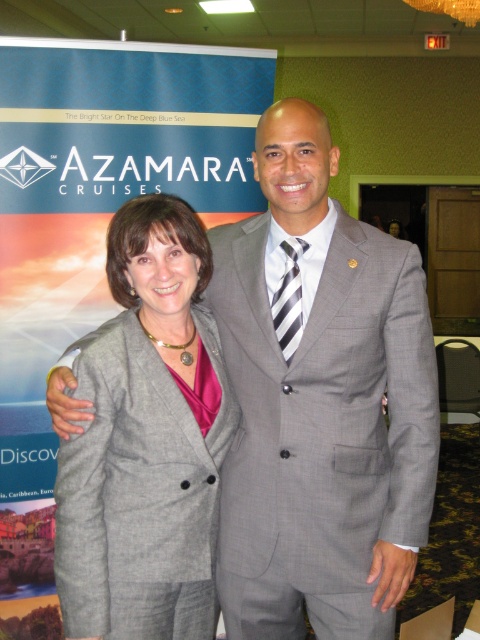
You are attending a cruise event and see two suits displayed at the center of the Azamara Cruises promotional backdrop. The gray textured suit at center and the gray wool suit at center. Which one is larger in size?

The gray textured suit at center is bigger than the gray wool suit at center.

You are attending a cruise event and see two suits displayed at the center of the Azamara Cruises promotional backdrop. The suits are labeled as gray textured suit at center and gray wool suit at center. Which one is positioned to the right?

The gray textured suit at center is positioned to the right of the gray wool suit at center.